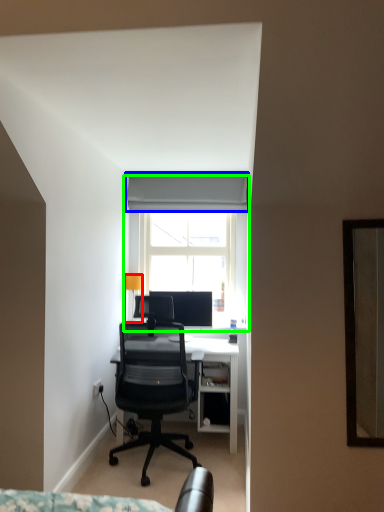
Question: Based on their relative distances, which object is nearer to lamp (highlighted by a red box)? Choose from curtain (highlighted by a blue box) and window (highlighted by a green box).

Choices:
 (A) curtain
 (B) window

Answer: (B)